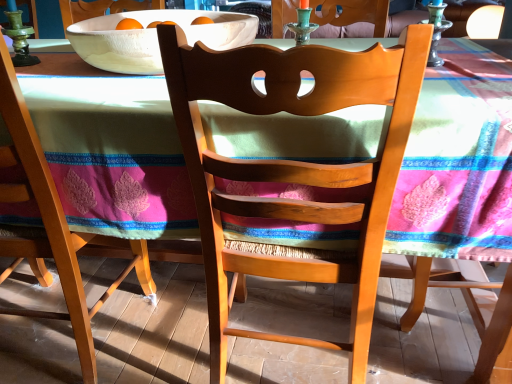
Question: Is green glass candle holder at upper center, which ranks as the 2th candle holder in right-to-left order, outside of white matte bowl at upper center?

Choices:
 (A) no
 (B) yes

Answer: (B)

Question: Does green glass candle holder at upper center, which ranks as the 2th candle holder in right-to-left order, have a larger size compared to white matte bowl at upper center?

Choices:
 (A) no
 (B) yes

Answer: (A)

Question: From a real-world perspective, is green glass candle holder at upper center, placed as the first candle holder when sorted from left to right, physically above white matte bowl at upper center?

Choices:
 (A) yes
 (B) no

Answer: (A)

Question: Considering the relative sizes of green glass candle holder at upper center, placed as the first candle holder when sorted from left to right, and white matte bowl at upper center in the image provided, is green glass candle holder at upper center, placed as the first candle holder when sorted from left to right, taller than white matte bowl at upper center?

Choices:
 (A) yes
 (B) no

Answer: (A)

Question: Is green glass candle holder at upper center, placed as the first candle holder when sorted from left to right, with white matte bowl at upper center?

Choices:
 (A) yes
 (B) no

Answer: (B)

Question: Does green glass candle holder at upper center, placed as the first candle holder when sorted from left to right, turn towards white matte bowl at upper center?

Choices:
 (A) no
 (B) yes

Answer: (A)

Question: From a real-world perspective, is white matte bowl at upper center over matte wood chair at center, the 2th chair viewed from the left?

Choices:
 (A) yes
 (B) no

Answer: (A)

Question: Can you confirm if white matte bowl at upper center is smaller than matte wood chair at center, the 2th chair viewed from the left?

Choices:
 (A) no
 (B) yes

Answer: (B)

Question: Can you confirm if white matte bowl at upper center is positioned to the right of matte wood chair at center, the 2th chair viewed from the left?

Choices:
 (A) yes
 (B) no

Answer: (B)

Question: Does white matte bowl at upper center appear on the left side of matte wood chair at center, which ranks as the 1th chair in right-to-left order?

Choices:
 (A) yes
 (B) no

Answer: (A)

Question: Can you confirm if white matte bowl at upper center is thinner than matte wood chair at center, the 2th chair viewed from the left?

Choices:
 (A) no
 (B) yes

Answer: (A)

Question: Is white matte bowl at upper center aimed at matte wood chair at center, which ranks as the 1th chair in right-to-left order?

Choices:
 (A) no
 (B) yes

Answer: (A)

Question: Is white matte bowl at upper center not within wooden chair at left, which is the first chair in left-to-right order?

Choices:
 (A) yes
 (B) no

Answer: (A)